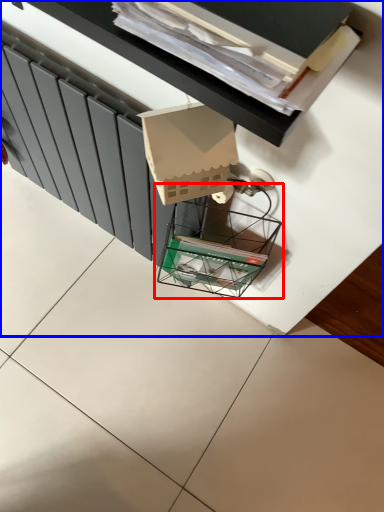
Question: Which object is closer to the camera taking this photo, glass box (highlighted by a red box) or furniture (highlighted by a blue box)?

Choices:
 (A) glass box
 (B) furniture

Answer: (B)